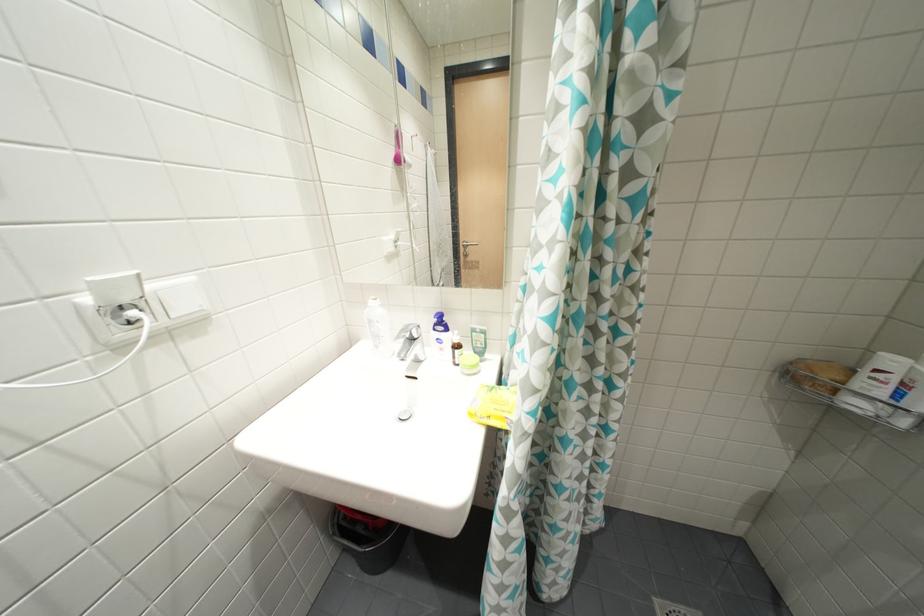
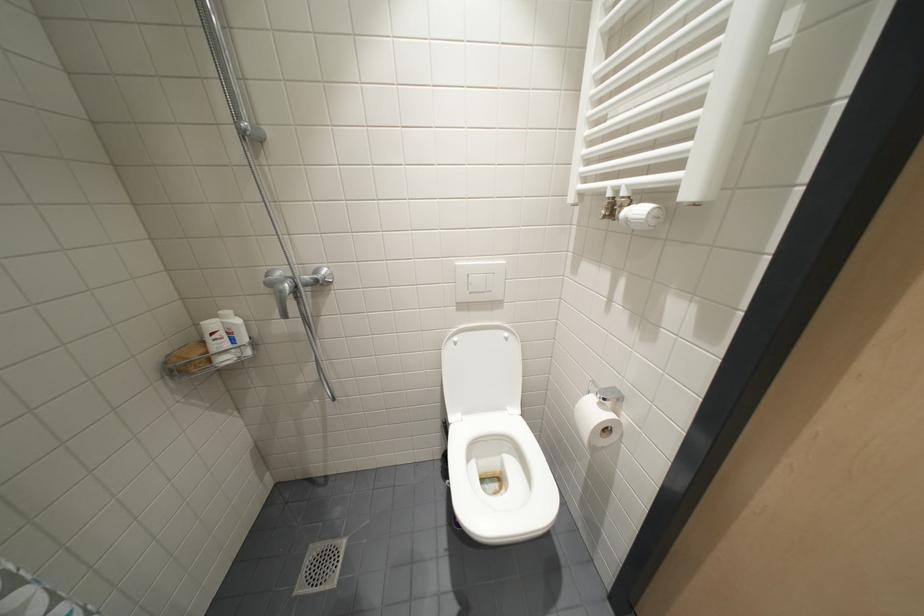
Based on the continuous images, in which direction is the camera rotating?

The camera's rotation is toward right-down.